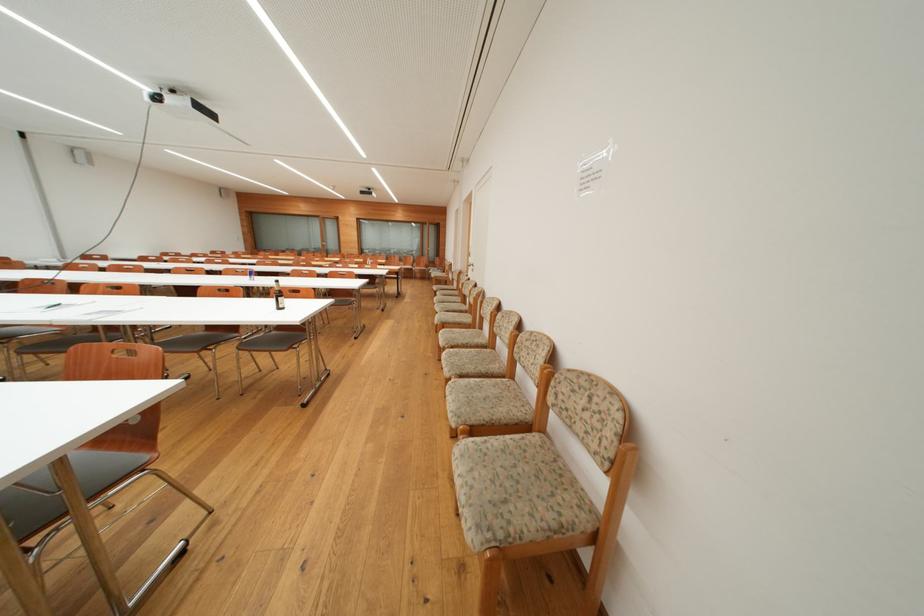
What are the coordinates of `silver door handle` in the screenshot? It's located at (475, 265).